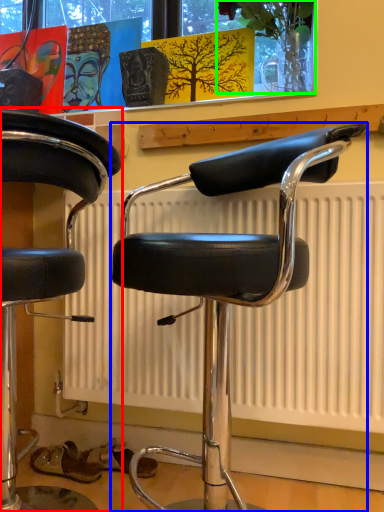
Question: Which object is positioned farthest from chair (highlighted by a red box)? Select from chair (highlighted by a blue box) and plant (highlighted by a green box).

Choices:
 (A) chair
 (B) plant

Answer: (B)